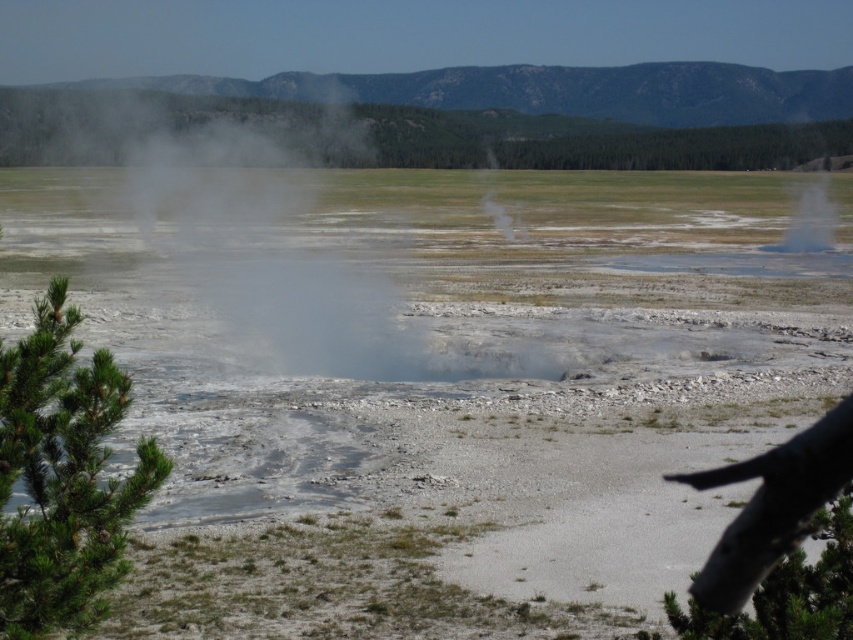
Question: Is green matte tree at lower left smaller than white vapor at center?

Choices:
 (A) yes
 (B) no

Answer: (A)

Question: Considering the relative positions of green matte tree at lower left and green rough bark branch at lower right in the image provided, where is green matte tree at lower left located with respect to green rough bark branch at lower right?

Choices:
 (A) above
 (B) below

Answer: (A)

Question: Which point appears closest to the camera in this image?

Choices:
 (A) (488, 148)
 (B) (782, 452)
 (C) (119, 371)

Answer: (B)

Question: From the image, what is the correct spatial relationship of green rough bark branch at lower right in relation to white vapor at center?

Choices:
 (A) right
 (B) left

Answer: (A)

Question: Which object is the closest to the white vapor at center?

Choices:
 (A) green matte tree at lower left
 (B) green rough bark branch at lower right

Answer: (B)

Question: Which point is farther from the camera taking this photo?

Choices:
 (A) (485, 179)
 (B) (39, 451)

Answer: (A)